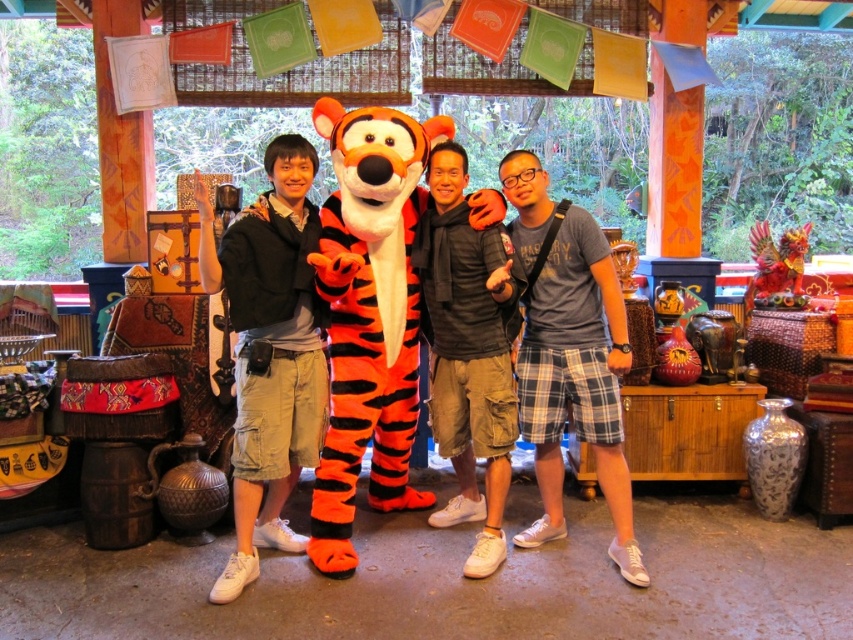
Which of these two, orange plush tiger at center or blue plaid shorts at center, stands taller?

orange plush tiger at center

The height and width of the screenshot is (640, 853). I want to click on orange plush tiger at center, so click(369, 316).

What are the coordinates of `orange plush tiger at center` in the screenshot? It's located at (369, 316).

Can you confirm if matte black jacket at center is thinner than blue plaid shorts at center?

Yes.

Does matte black jacket at center appear under blue plaid shorts at center?

Incorrect, matte black jacket at center is not positioned below blue plaid shorts at center.

I want to click on matte black jacket at center, so click(x=270, y=353).

The image size is (853, 640). What are the coordinates of `orange plush tiger at center` in the screenshot? It's located at [369, 316].

Is orange plush tiger at center above matte black jacket at center?

Indeed, orange plush tiger at center is positioned over matte black jacket at center.

Locate an element on the screen. The width and height of the screenshot is (853, 640). orange plush tiger at center is located at coordinates (369, 316).

Image resolution: width=853 pixels, height=640 pixels. What are the coordinates of `orange plush tiger at center` in the screenshot? It's located at (369, 316).